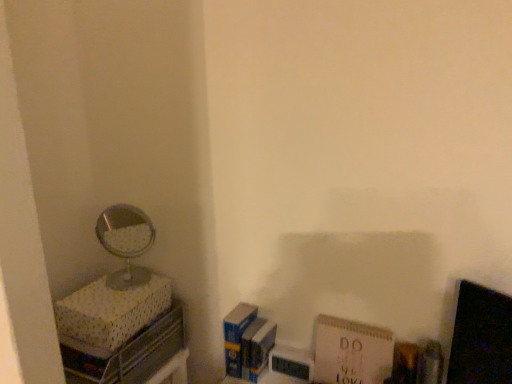
Question: Can you confirm if blue matte paperback book at lower center, arranged as the 2th paperback book when viewed from the right, is positioned to the left of shiny silver mirror at left?

Choices:
 (A) no
 (B) yes

Answer: (A)

Question: From a real-world perspective, is blue matte paperback book at lower center, arranged as the 2th paperback book when viewed from the right, over shiny silver mirror at left?

Choices:
 (A) no
 (B) yes

Answer: (A)

Question: From the image's perspective, is blue matte paperback book at lower center, arranged as the 2th paperback book when viewed from the right, beneath shiny silver mirror at left?

Choices:
 (A) yes
 (B) no

Answer: (A)

Question: Is blue matte paperback book at lower center, which is the 1th paperback book in left-to-right order, not close to shiny silver mirror at left?

Choices:
 (A) no
 (B) yes

Answer: (A)

Question: Does blue matte paperback book at lower center, arranged as the 2th paperback book when viewed from the right, turn towards shiny silver mirror at left?

Choices:
 (A) yes
 (B) no

Answer: (B)

Question: From their relative heights in the image, would you say shiny silver mirror at left is taller or shorter than blue matte paperback book at lower center, which is the 1th paperback book in left-to-right order?

Choices:
 (A) tall
 (B) short

Answer: (A)

Question: In terms of width, does shiny silver mirror at left look wider or thinner when compared to blue matte paperback book at lower center, which is the 1th paperback book in left-to-right order?

Choices:
 (A) wide
 (B) thin

Answer: (A)

Question: Do you think shiny silver mirror at left is within blue matte paperback book at lower center, arranged as the 2th paperback book when viewed from the right, or outside of it?

Choices:
 (A) outside
 (B) inside

Answer: (A)

Question: Is shiny silver mirror at left in front of or behind blue matte paperback book at lower center, which is the 1th paperback book in left-to-right order, in the image?

Choices:
 (A) front
 (B) behind

Answer: (A)

Question: Considering their positions, is white paper at lower right, marked as the second paperback book in a left-to-right arrangement, located in front of or behind blue matte paperback book at lower center, arranged as the 2th paperback book when viewed from the right?

Choices:
 (A) behind
 (B) front

Answer: (B)

Question: Considering the positions of white paper at lower right, which is the first paperback book in right-to-left order, and blue matte paperback book at lower center, arranged as the 2th paperback book when viewed from the right, in the image, is white paper at lower right, which is the first paperback book in right-to-left order, wider or thinner than blue matte paperback book at lower center, arranged as the 2th paperback book when viewed from the right,?

Choices:
 (A) wide
 (B) thin

Answer: (B)

Question: Would you say white paper at lower right, marked as the second paperback book in a left-to-right arrangement, is to the left or to the right of blue matte paperback book at lower center, which is the 1th paperback book in left-to-right order, in the picture?

Choices:
 (A) right
 (B) left

Answer: (A)

Question: Is white paper at lower right, marked as the second paperback book in a left-to-right arrangement, taller or shorter than blue matte paperback book at lower center, which is the 1th paperback book in left-to-right order?

Choices:
 (A) tall
 (B) short

Answer: (A)

Question: In terms of width, does shiny silver mirror at left look wider or thinner when compared to white paper at lower right, which is the first paperback book in right-to-left order?

Choices:
 (A) thin
 (B) wide

Answer: (B)

Question: Considering their positions, is shiny silver mirror at left located in front of or behind white paper at lower right, which is the first paperback book in right-to-left order?

Choices:
 (A) behind
 (B) front

Answer: (A)